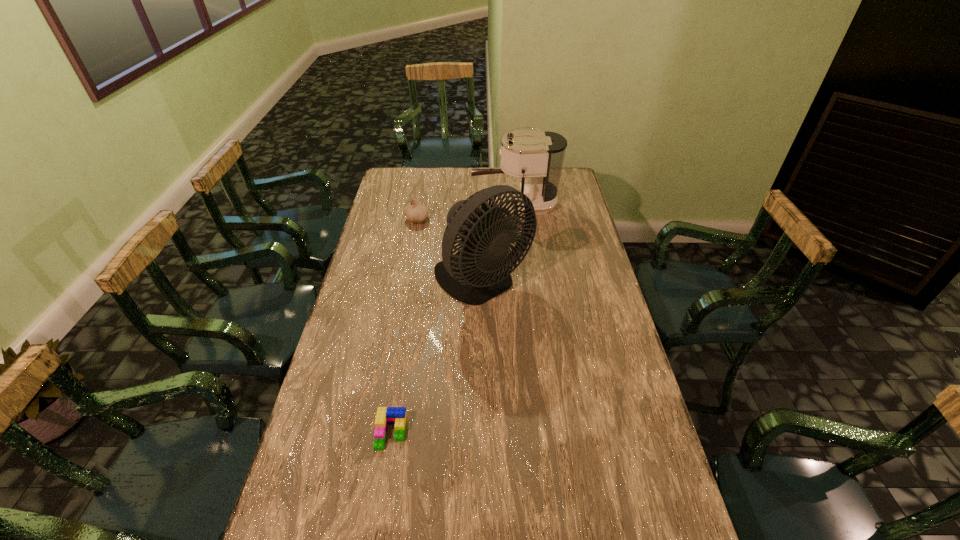
Find the location of a particular element. free region located on the left of the second shortest object is located at coordinates (388, 220).

Where is `free space located 0.170m on the left of the Lego`? free space located 0.170m on the left of the Lego is located at coordinates (313, 433).

Image resolution: width=960 pixels, height=540 pixels. Identify the location of object at the far edge. (538, 155).

This screenshot has height=540, width=960. Identify the location of object that is positioned at the left edge. (415, 212).

I want to click on object situated at the right edge, so click(x=538, y=155).

Locate an element on the screen. object at the far right corner is located at coordinates (538, 155).

Find the location of a particular element. The image size is (960, 540). vacant area at the far edge is located at coordinates [x=467, y=188].

You are a GUI agent. You are given a task and a screenshot of the screen. Output one action in this format:
    pyautogui.click(x=<x>, y=<y>)
    Task: Click on the free space at the left edge of the desktop
    The image size is (960, 540).
    Given the screenshot: What is the action you would take?
    [371, 302]

Find the location of a particular element. Image resolution: width=960 pixels, height=540 pixels. vacant position at the right edge of the desktop is located at coordinates (577, 325).

This screenshot has height=540, width=960. What are the coordinates of `free location at the far right corner of the desktop` in the screenshot? It's located at (572, 179).